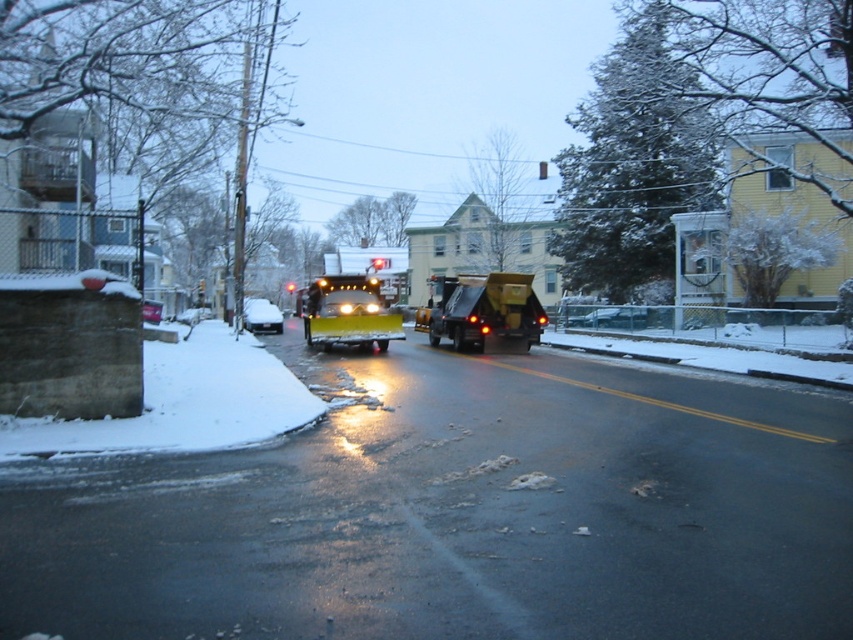
Question: Is yellow rubber snowplow at center to the right of metallic yellow garbage truck at center from the viewer's perspective?

Choices:
 (A) no
 (B) yes

Answer: (A)

Question: Can you confirm if metallic yellow garbage truck at center is positioned below white matte car at center?

Choices:
 (A) no
 (B) yes

Answer: (A)

Question: Is yellow rubber snowplow at center positioned in front of metallic yellow garbage truck at center?

Choices:
 (A) yes
 (B) no

Answer: (A)

Question: Which point is farther from the camera taking this photo?

Choices:
 (A) (144, 300)
 (B) (263, 323)

Answer: (B)

Question: Estimate the real-world distances between objects in this image. Which object is farther from the yellow rubber snowplow at center?

Choices:
 (A) metallic silver sedan at center
 (B) metallic yellow garbage truck at center
 (C) white matte car at center

Answer: (A)

Question: Which object appears farthest from the camera in this image?

Choices:
 (A) white matte car at center
 (B) yellow rubber snowplow at center
 (C) metallic silver sedan at center
 (D) metallic yellow garbage truck at center

Answer: (A)